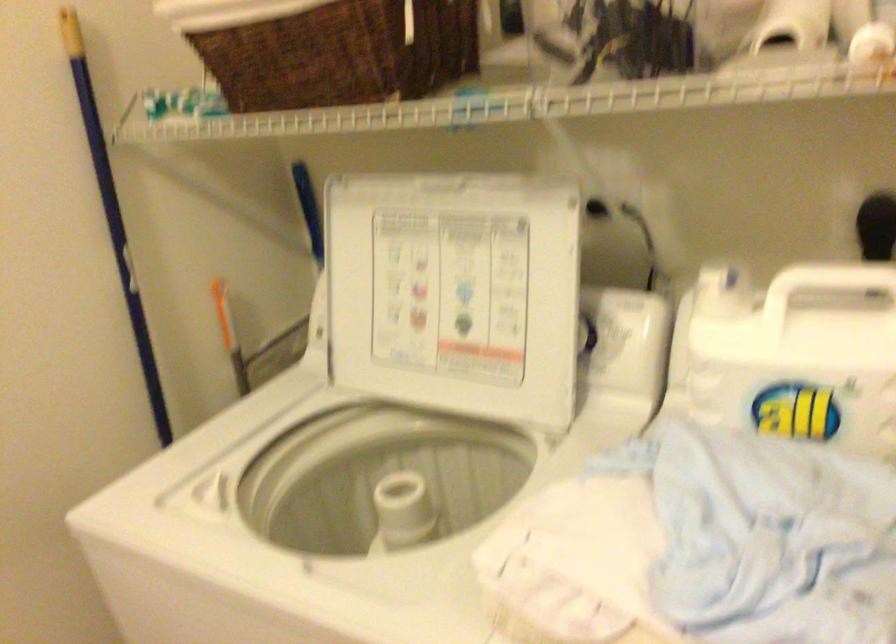
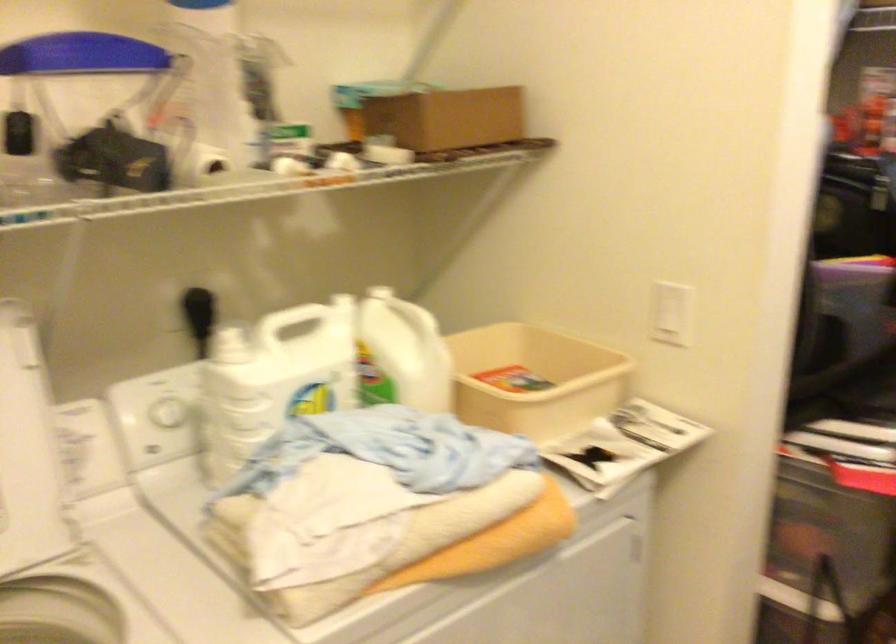
Find the pixel in the second image that matches [741,357] in the first image.

(273, 379)